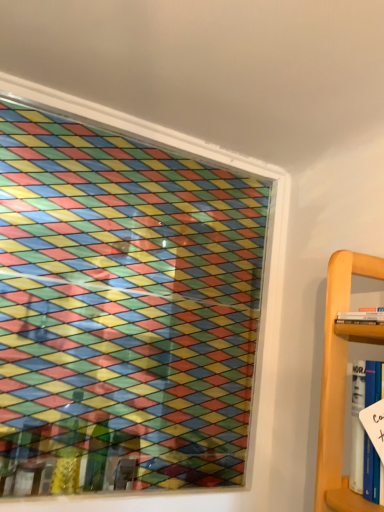
Question: In terms of size, does white paper at right, acting as the 2th book starting from the top, appear bigger or smaller than white paperback book at right, which ranks as the 1th book in top-to-bottom order?

Choices:
 (A) small
 (B) big

Answer: (B)

Question: Visually, is white paper at right, acting as the 2th book starting from the top, positioned to the left or to the right of white paperback book at right, the 2th book when ordered from bottom to top?

Choices:
 (A) left
 (B) right

Answer: (A)

Question: Is white paper at right, acting as the 2th book starting from the top, in front of or behind white paperback book at right, which ranks as the 1th book in top-to-bottom order, in the image?

Choices:
 (A) behind
 (B) front

Answer: (B)

Question: From a real-world perspective, is white paperback book at right, the 2th book when ordered from bottom to top, positioned above or below white paper at right, acting as the 2th book starting from the top?

Choices:
 (A) above
 (B) below

Answer: (A)

Question: Considering the positions of white paperback book at right, the 2th book when ordered from bottom to top, and white paper at right, marked as the 1th book in a bottom-to-top arrangement, in the image, is white paperback book at right, the 2th book when ordered from bottom to top, wider or thinner than white paper at right, marked as the 1th book in a bottom-to-top arrangement,?

Choices:
 (A) wide
 (B) thin

Answer: (A)

Question: Based on their sizes in the image, would you say white paperback book at right, which ranks as the 1th book in top-to-bottom order, is bigger or smaller than white paper at right, acting as the 2th book starting from the top?

Choices:
 (A) small
 (B) big

Answer: (A)

Question: From their relative heights in the image, would you say white paperback book at right, which ranks as the 1th book in top-to-bottom order, is taller or shorter than white paper at right, acting as the 2th book starting from the top?

Choices:
 (A) tall
 (B) short

Answer: (B)